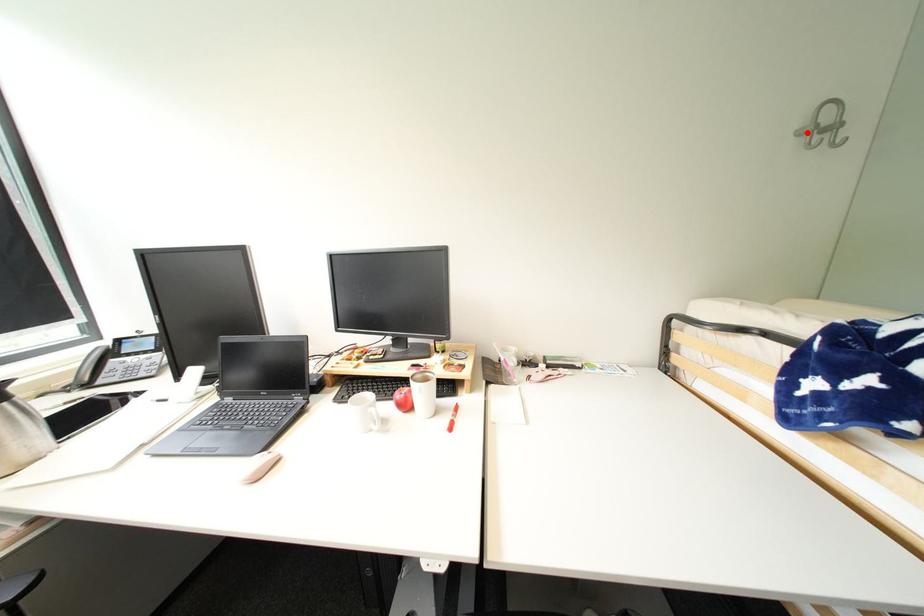
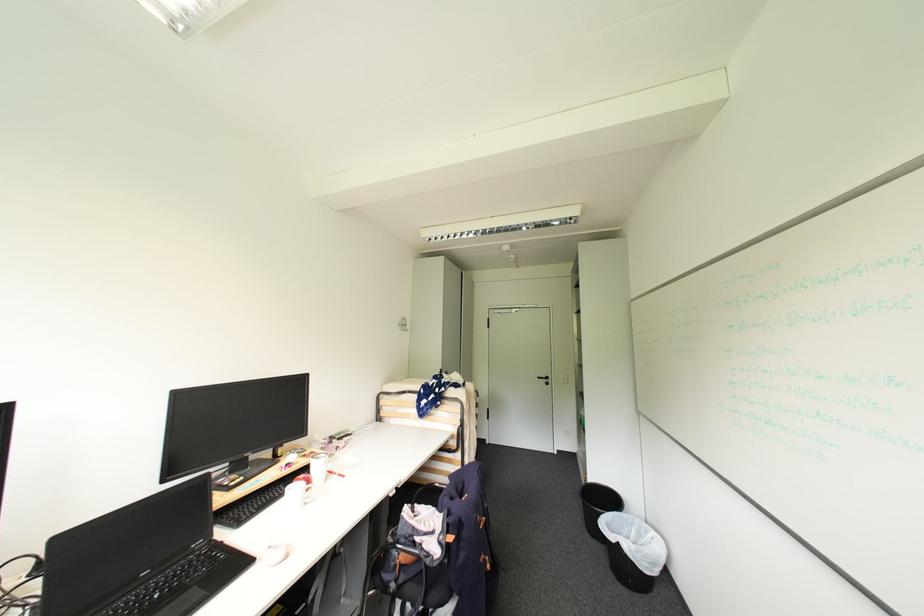
The point at the highlighted location is marked in the first image. Where is the corresponding point in the second image?

(406, 325)